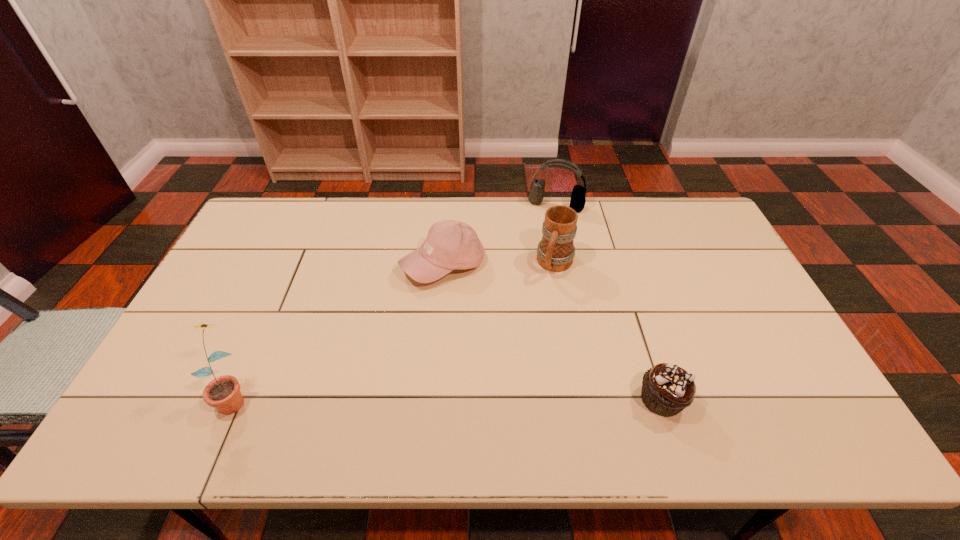
This screenshot has height=540, width=960. I want to click on vacant space located on the front-facing side of the baseball cap, so tap(438, 353).

This screenshot has width=960, height=540. I want to click on vacant space situated on the headband of the farthest object, so click(543, 227).

Locate an element on the screen. vacant space located 0.070m on the headband of the farthest object is located at coordinates (544, 225).

This screenshot has width=960, height=540. Identify the location of free region located 0.090m on the headband of the farthest object. (543, 228).

Find the location of a particular element. This screenshot has width=960, height=540. vacant space situated 0.360m on the side of the mug with the handle is located at coordinates (509, 374).

Find the location of a particular element. vacant space located on the side of the mug with the handle is located at coordinates (532, 323).

Find the location of `vacant space located 0.070m on the side of the mug with the handle`. vacant space located 0.070m on the side of the mug with the handle is located at coordinates (543, 296).

Find the location of `object located in the far edge section of the desktop`. object located in the far edge section of the desktop is located at coordinates (577, 202).

Find the location of a particular element. sunflower at the near edge is located at coordinates [223, 393].

Where is `cupcake that is at the near edge`? This screenshot has width=960, height=540. cupcake that is at the near edge is located at coordinates (667, 389).